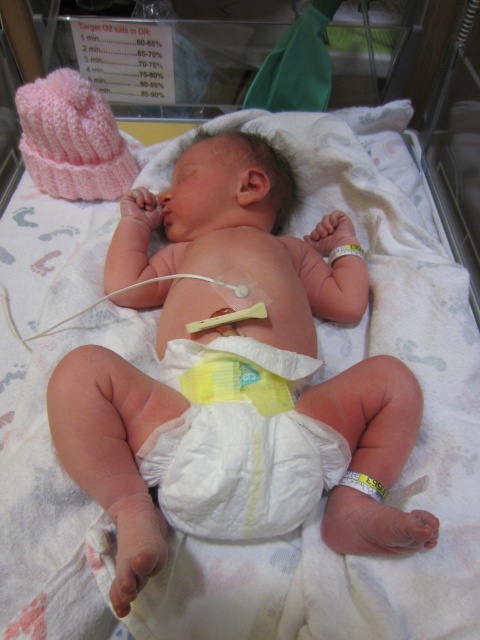
Does point (169, 433) come behind point (261, 301)?

No, it is not.

Which is behind, point (289, 436) or point (31, 340)?

Point (31, 340)

Locate an element on the screen. This screenshot has width=480, height=640. white cloth diaper at center is located at coordinates (240, 442).

Where is `white cloth diaper at center`? white cloth diaper at center is located at coordinates (240, 442).